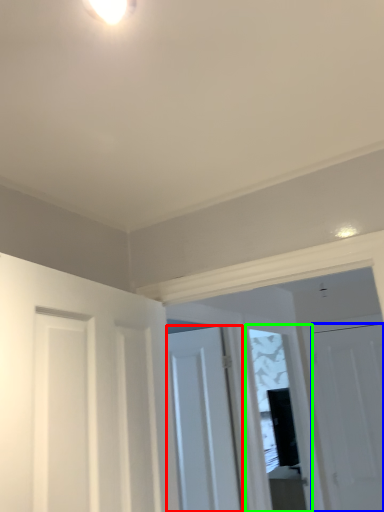
Question: Which is farther away from door (highlighted by a red box)? door (highlighted by a blue box) or window (highlighted by a green box)?

Choices:
 (A) door
 (B) window

Answer: (B)